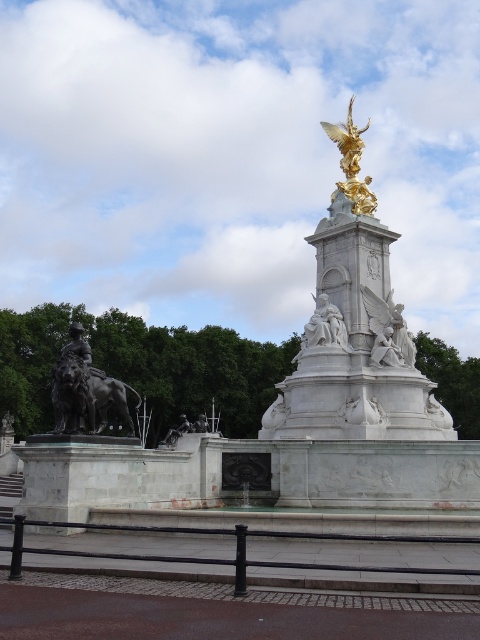
From the picture: You are an art student analyzing the monument. You observe the white marble angel at lower right and the gold metallic angel at upper center. Which angel appears smaller in size?

The white marble angel at lower right appears smaller in size because its width is less than the gold metallic angel at upper center.

You are an art student analyzing the monument. You notice two angels in the scene. The white marble angel at lower right and the gold metallic angel at upper center. Which angel is placed higher in the monument?

The gold metallic angel at upper center is placed higher than the white marble angel at lower right.